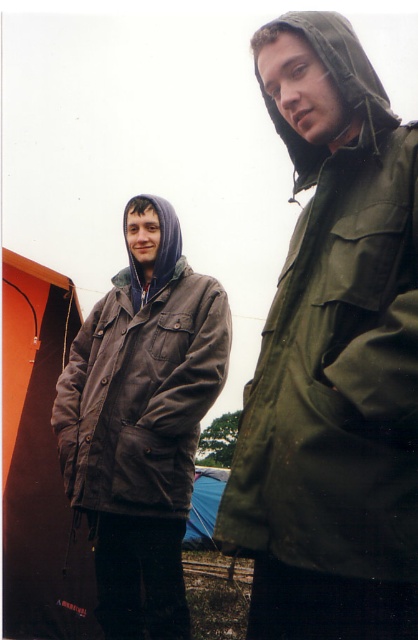
Is matte olive-green jacket at center thinner than green matte hood at upper right?

In fact, matte olive-green jacket at center might be wider than green matte hood at upper right.

Does matte olive-green jacket at center appear on the left side of green matte hood at upper right?

Indeed, matte olive-green jacket at center is positioned on the left side of green matte hood at upper right.

Is point (282, 465) positioned after point (295, 186)?

That is False.

Find the location of a particular element. The width and height of the screenshot is (418, 640). matte olive-green jacket at center is located at coordinates (333, 358).

Who is shorter, brown leather jacket at left or green matte hood at upper right?

Standing shorter between the two is green matte hood at upper right.

Between point (185, 595) and point (313, 35), which one is positioned behind?

The point (185, 595) is more distant.

Is point (96, 579) less distant than point (255, 58)?

No, it is not.

Image resolution: width=418 pixels, height=640 pixels. Identify the location of brown leather jacket at left. (142, 420).

Who is shorter, matte olive-green jacket at center or blue fabric tent at lower center?

With less height is blue fabric tent at lower center.

Is matte olive-green jacket at center taller than blue fabric tent at lower center?

Yes.

Is point (356, 406) farther from viewer compared to point (191, 538)?

That is False.

Where is `matte olive-green jacket at center`? The height and width of the screenshot is (640, 418). matte olive-green jacket at center is located at coordinates (333, 358).